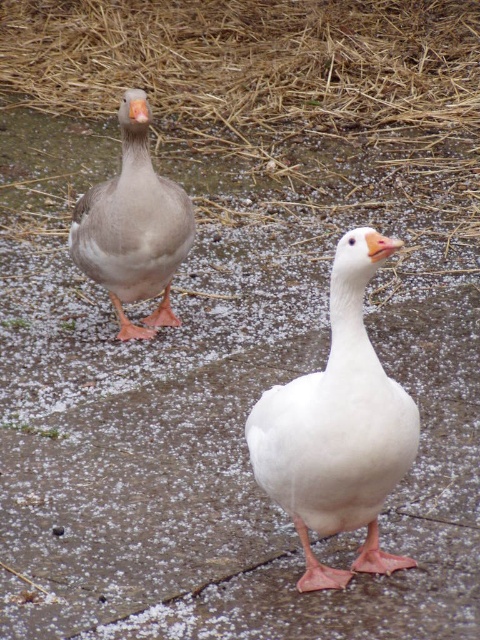
Question: Which object is closer to the camera taking this photo?

Choices:
 (A) white matte duck at center
 (B) gray matte duck at center
 (C) orange matte beak at center

Answer: (C)

Question: Which object is positioned closest to the matte gray beak at upper left?

Choices:
 (A) gray matte duck at center
 (B) brown straw at upper center
 (C) white matte duck at center
 (D) orange matte beak at center

Answer: (A)

Question: Which point is closer to the camera taking this photo?

Choices:
 (A) (334, 449)
 (B) (141, 321)

Answer: (A)

Question: In this image, where is brown straw at upper center located relative to orange matte beak at center?

Choices:
 (A) left
 (B) right

Answer: (A)

Question: Observing the image, what is the correct spatial positioning of orange matte beak at center in reference to matte gray beak at upper left?

Choices:
 (A) right
 (B) left

Answer: (A)

Question: Is the position of brown straw at upper center more distant than that of orange matte beak at center?

Choices:
 (A) yes
 (B) no

Answer: (A)